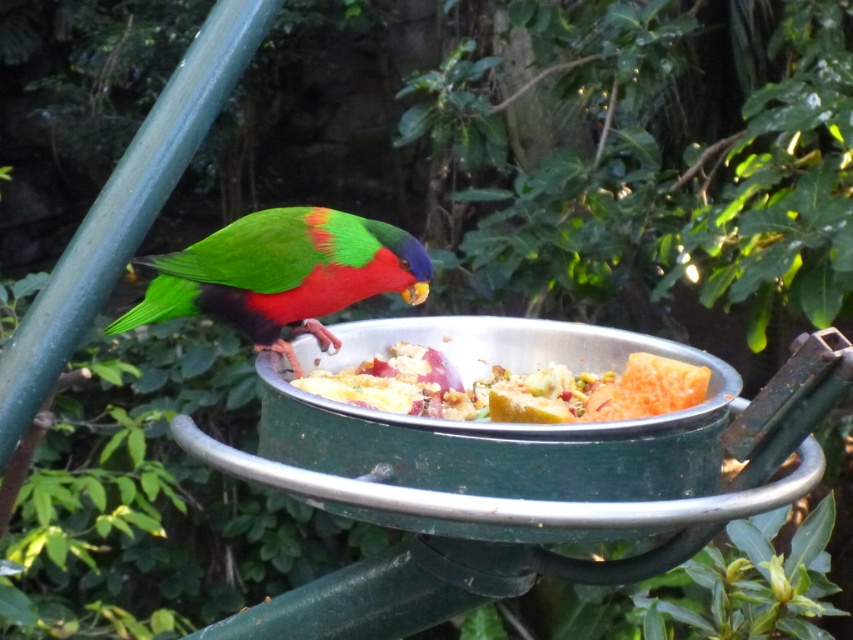
Is point (180, 257) farther from viewer compared to point (572, 384)?

Yes, point (180, 257) is farther from viewer.

Identify the location of green matte parrot at center. The height and width of the screenshot is (640, 853). (282, 275).

You are a GUI agent. You are given a task and a screenshot of the screen. Output one action in this format:
    pyautogui.click(x=<x>, y=<y>)
    Task: Click on the green matte parrot at center
    The height and width of the screenshot is (640, 853).
    Given the screenshot: What is the action you would take?
    pyautogui.click(x=282, y=275)

Which is in front, point (590, 536) or point (360, 288)?

Positioned in front is point (590, 536).

Between metallic silver bird feeder at center and green matte parrot at center, which one appears on the left side from the viewer's perspective?

Positioned to the left is green matte parrot at center.

Which is behind, point (291, 410) or point (352, 224)?

Point (352, 224)

Identify the location of metallic silver bird feeder at center. This screenshot has height=640, width=853. [x=514, y=470].

Does metallic silver bird feeder at center appear under shiny metallic bowl at center?

Correct, metallic silver bird feeder at center is located below shiny metallic bowl at center.

Does metallic silver bird feeder at center appear on the right side of shiny metallic bowl at center?

Indeed, metallic silver bird feeder at center is positioned on the right side of shiny metallic bowl at center.

The image size is (853, 640). What do you see at coordinates (514, 470) in the screenshot?
I see `metallic silver bird feeder at center` at bounding box center [514, 470].

Identify the location of metallic silver bird feeder at center. (514, 470).